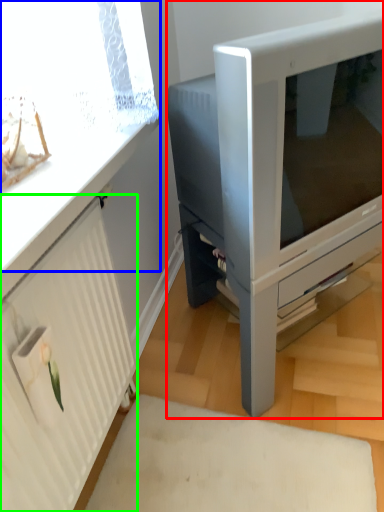
Question: Estimate the real-world distances between objects in this image. Which object is closer to furniture (highlighted by a red box), window screen (highlighted by a blue box) or radiator (highlighted by a green box)?

Choices:
 (A) window screen
 (B) radiator

Answer: (A)